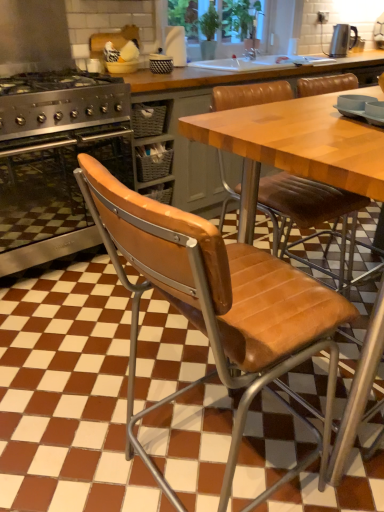
Find the location of a particular element. free spot below brown leather chair at center (from a real-world perspective) is located at coordinates (221, 470).